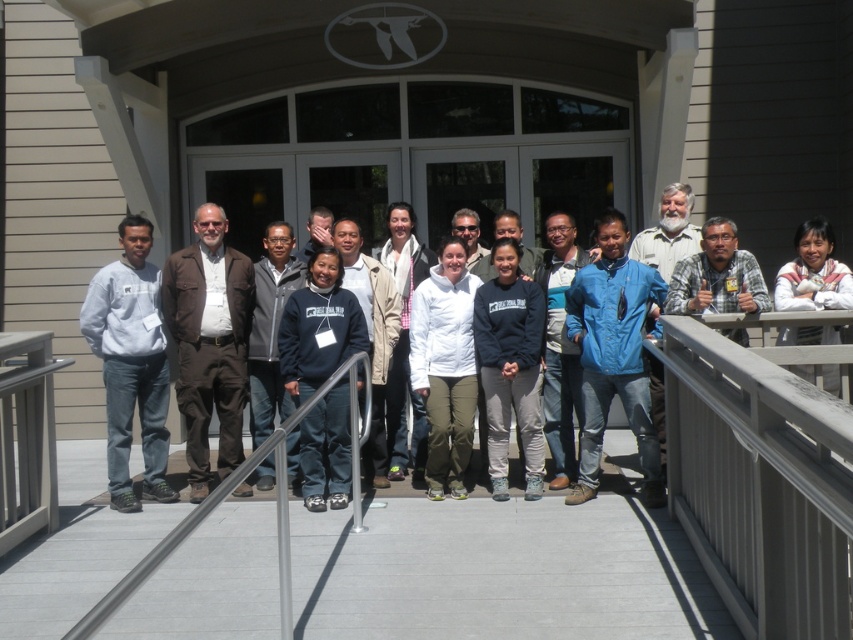
Between blue fabric shirt at center and matte blue hoodie at center, which one appears on the right side from the viewer's perspective?

blue fabric shirt at center is more to the right.

Is point (717, 280) in front of point (317, 209)?

That is True.

Does point (712, 234) come behind point (320, 227)?

No, (712, 234) is in front of (320, 227).

Locate an element on the screen. The image size is (853, 640). blue fabric shirt at center is located at coordinates (717, 275).

Describe the element at coordinates (762, 472) in the screenshot. I see `gray wood balustrade at right` at that location.

Is point (683, 518) positioned behind point (309, 241)?

No, (683, 518) is closer to viewer.

The height and width of the screenshot is (640, 853). In order to click on gray wood balustrade at right in this screenshot , I will do `click(762, 472)`.

The image size is (853, 640). I want to click on gray wood balustrade at right, so click(x=762, y=472).

Is point (38, 589) less distant than point (848, 282)?

Yes, it is in front of point (848, 282).

This screenshot has height=640, width=853. What are the coordinates of `smooth concrete porch at center` in the screenshot? It's located at (500, 572).